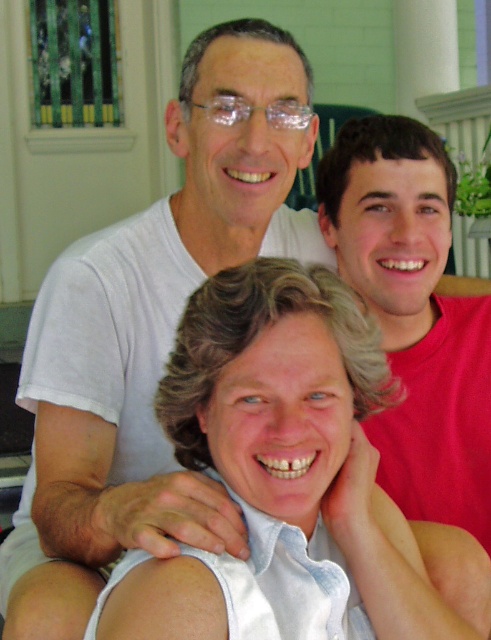
You are a photographer trying to capture a candid shot of the red matte shirt at upper right without the gray silk shirt at center blocking the view. Is this possible based on their current positions?

The gray silk shirt at center is in front of the red matte shirt at upper right, so it would block the view. To capture the red matte shirt at upper right without obstruction, you would need to adjust the angle or position to ensure the gray silk shirt at center is not in front anymore.